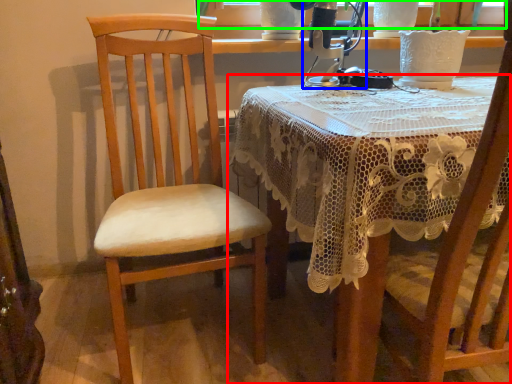
Question: Based on their relative distances, which object is nearer to table (highlighted by a red box)? Choose from sewing machine (highlighted by a blue box) and window screen (highlighted by a green box).

Choices:
 (A) sewing machine
 (B) window screen

Answer: (A)